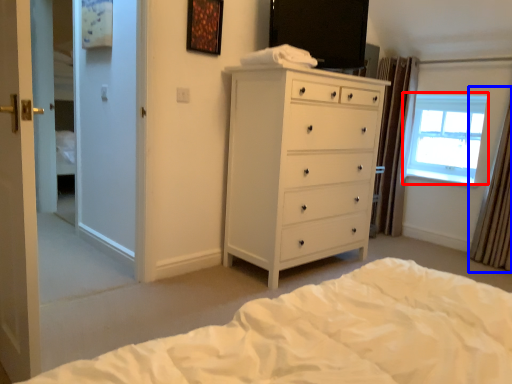
Question: Which object is closer to the camera taking this photo, window (highlighted by a red box) or curtain (highlighted by a blue box)?

Choices:
 (A) window
 (B) curtain

Answer: (B)